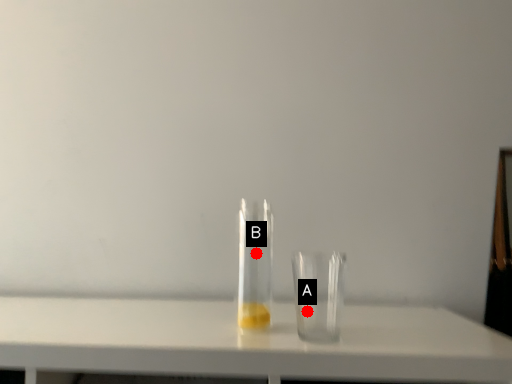
Question: Two points are circled on the image, labeled by A and B beside each circle. Which point is closer to the camera?

Choices:
 (A) A is closer
 (B) B is closer

Answer: (B)